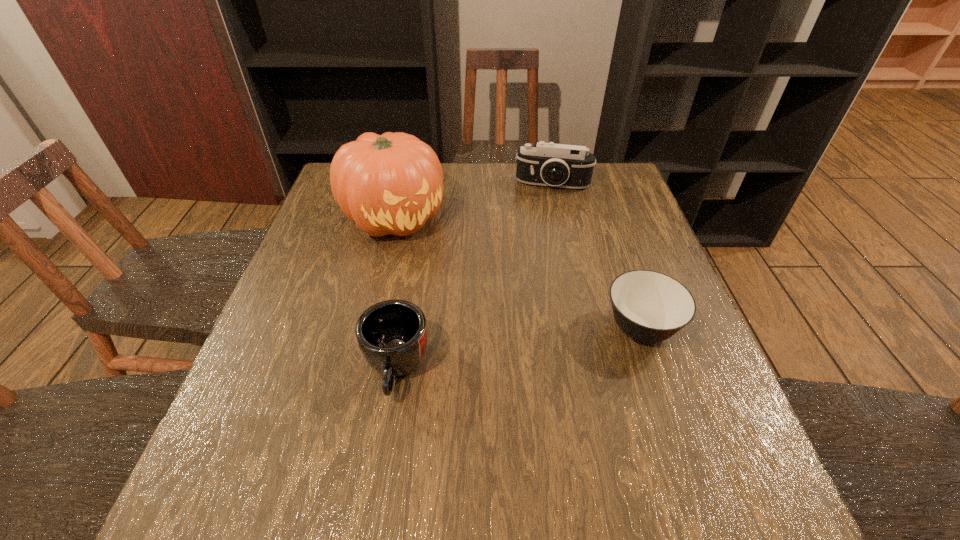
Where is `free spot located on the carved face of the pumpkin`? free spot located on the carved face of the pumpkin is located at coordinates (509, 330).

Find the location of `vacant region located 0.400m on the carved face of the pumpkin`. vacant region located 0.400m on the carved face of the pumpkin is located at coordinates (521, 342).

Identify the location of camera situated at the far edge. The image size is (960, 540). (558, 165).

Find the location of a particular element. pumpkin positioned at the far edge is located at coordinates pyautogui.click(x=392, y=183).

Where is `object located at the near edge`? This screenshot has width=960, height=540. object located at the near edge is located at coordinates (x=392, y=335).

This screenshot has height=540, width=960. In order to click on object situated at the left edge in this screenshot , I will do pyautogui.click(x=392, y=183).

Identify the location of soup bowl present at the right edge. (649, 306).

Locate an element on the screen. This screenshot has height=540, width=960. camera at the right edge is located at coordinates (558, 165).

Where is `object present at the far left corner`? This screenshot has height=540, width=960. object present at the far left corner is located at coordinates (392, 183).

I want to click on object at the far right corner, so click(x=558, y=165).